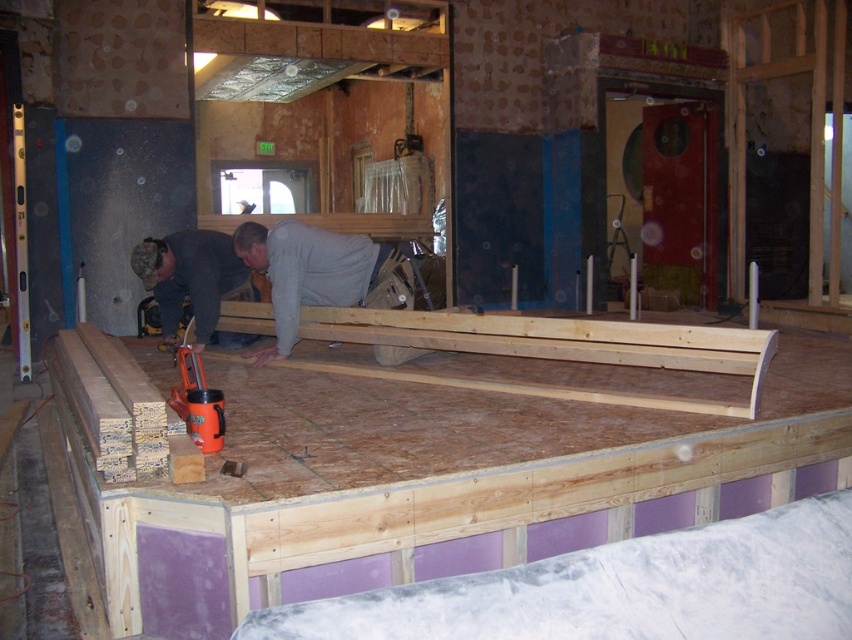
Does natural wood workbench at center have a greater height compared to gray matte shirt at center?

Incorrect, natural wood workbench at center's height is not larger of gray matte shirt at center's.

Based on the photo, does natural wood workbench at center have a greater width compared to gray matte shirt at center?

Yes, natural wood workbench at center is wider than gray matte shirt at center.

The height and width of the screenshot is (640, 852). Describe the element at coordinates (438, 483) in the screenshot. I see `natural wood workbench at center` at that location.

The image size is (852, 640). Find the location of `natural wood workbench at center`. natural wood workbench at center is located at coordinates (438, 483).

Based on the photo, which of these two, gray matte shirt at center or camouflage fabric shirt at center, stands shorter?

Standing shorter between the two is camouflage fabric shirt at center.

Who is taller, gray matte shirt at center or camouflage fabric shirt at center?

Standing taller between the two is gray matte shirt at center.

Is point (315, 241) positioned behind point (162, 291)?

That is False.

Locate an element on the screen. gray matte shirt at center is located at coordinates (304, 272).

Is natural wood workbench at center closer to camera compared to camouflage fabric shirt at center?

Yes.

Can you confirm if natural wood workbench at center is positioned to the left of camouflage fabric shirt at center?

Incorrect, natural wood workbench at center is not on the left side of camouflage fabric shirt at center.

Is point (603, 531) positioned behind point (190, 278)?

No.

I want to click on natural wood workbench at center, so click(x=438, y=483).